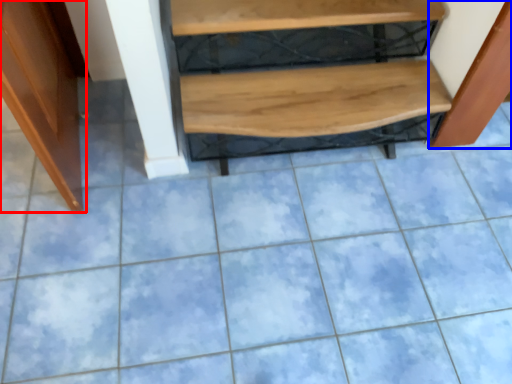
Question: Which object appears farthest to the camera in this image, furniture (highlighted by a red box) or cabinetry (highlighted by a blue box)?

Choices:
 (A) furniture
 (B) cabinetry

Answer: (B)